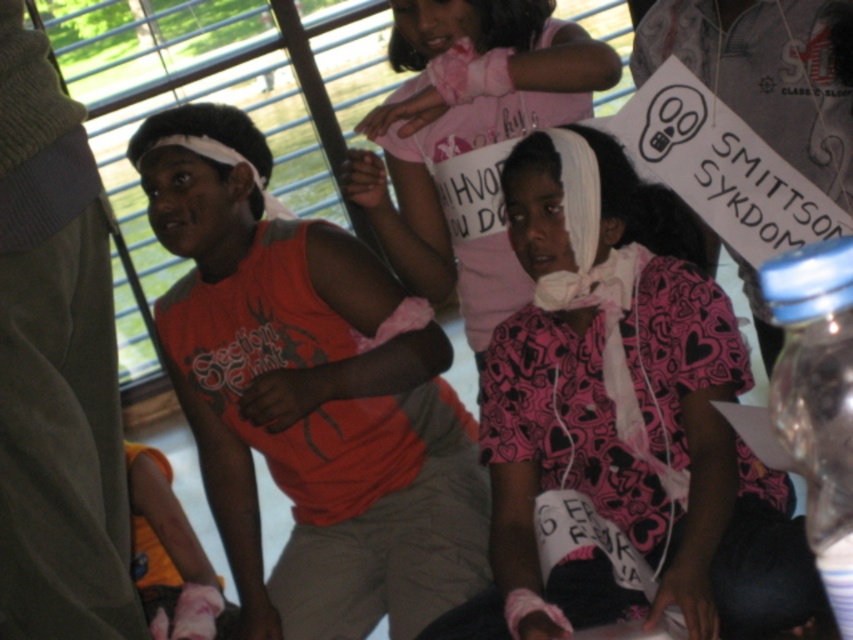
Which is below, pink fabric bandage at center or transparent plastic bottle at right?

transparent plastic bottle at right

Does pink fabric bandage at center have a larger size compared to transparent plastic bottle at right?

Yes.

Locate an element on the screen. Image resolution: width=853 pixels, height=640 pixels. pink fabric bandage at center is located at coordinates (624, 419).

Locate an element on the screen. This screenshot has width=853, height=640. pink fabric bandage at center is located at coordinates (624, 419).

Image resolution: width=853 pixels, height=640 pixels. Identify the location of pink fabric bandage at center. (624, 419).

Which is below, white bandage at center or transparent plastic bottle at right?

Positioned lower is transparent plastic bottle at right.

Does white bandage at center appear on the left side of transparent plastic bottle at right?

Yes, white bandage at center is to the left of transparent plastic bottle at right.

Does point (422, 252) come closer to viewer compared to point (819, 301)?

That is False.

Find the location of a particular element. The width and height of the screenshot is (853, 640). white bandage at center is located at coordinates (466, 138).